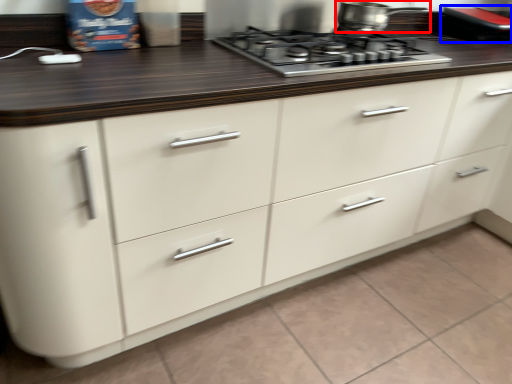
Question: Which object appears closest to the camera in this image, kitchen appliance (highlighted by a red box) or appliance (highlighted by a blue box)?

Choices:
 (A) kitchen appliance
 (B) appliance

Answer: (A)